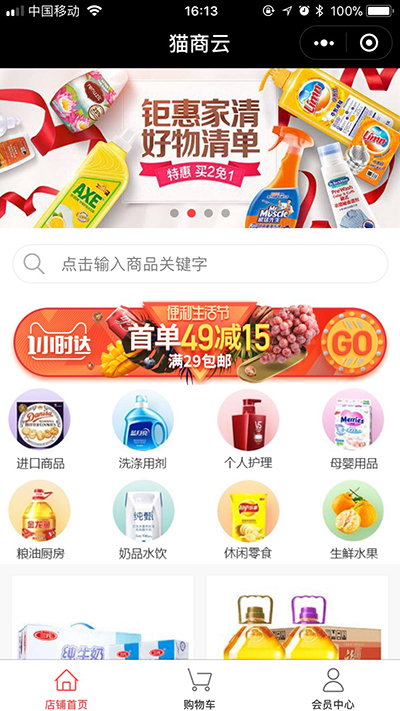
At what (x,y) coordinates should I click in order to perform the action: click on handle. Please return your answer as a coordinate pair (x, y). The width and height of the screenshot is (400, 711). Looking at the image, I should click on (255, 593), (319, 597), (162, 427), (49, 491).